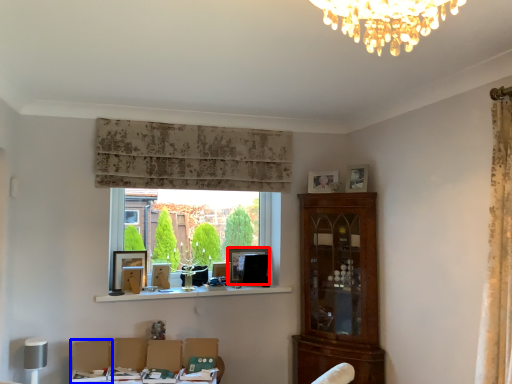
Question: Which object appears closest to the camera in this image, picture frame (highlighted by a red box) or swivel chair (highlighted by a blue box)?

Choices:
 (A) picture frame
 (B) swivel chair

Answer: (B)